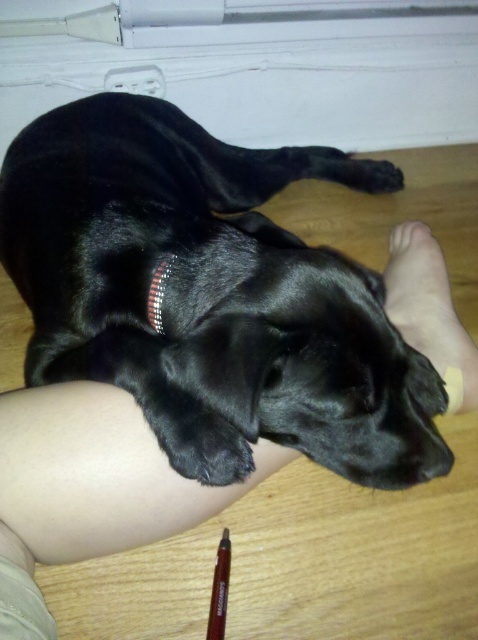
Does skinny flesh at lower left have a lesser width compared to shiny metallic collar at center?

No, skinny flesh at lower left is not thinner than shiny metallic collar at center.

Is point (170, 497) in front of point (163, 268)?

That is True.

Where is `skinny flesh at lower left`? This screenshot has height=640, width=478. skinny flesh at lower left is located at coordinates (89, 486).

Locate an element on the screen. This screenshot has width=478, height=640. skinny flesh at lower left is located at coordinates (89, 486).

Is point (423, 236) more distant than point (213, 577)?

Yes, it is.

Is smooth skin foot at lower right above brown matte pencil at lower center?

Correct, smooth skin foot at lower right is located above brown matte pencil at lower center.

Does point (393, 236) come farther from viewer compared to point (217, 570)?

Yes, point (393, 236) is farther from viewer.

Find the location of a particular element. smooth skin foot at lower right is located at coordinates (430, 310).

Does brown matte pencil at lower center have a smaller size compared to shiny metallic collar at center?

No.

Between point (219, 540) and point (159, 323), which one is positioned behind?

Point (219, 540)

This screenshot has width=478, height=640. Find the location of `brown matte pencil at lower center`. brown matte pencil at lower center is located at coordinates coord(219,589).